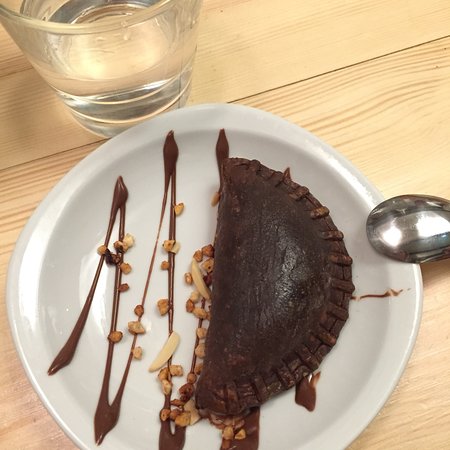
In order to click on table in this screenshot , I will do `click(417, 425)`.